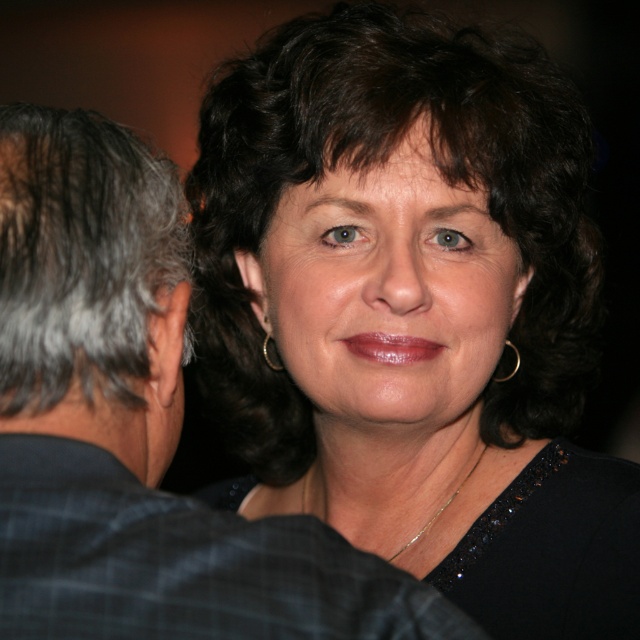
Is black fabric at center shorter than gold metallic earring at right?

No, black fabric at center is not shorter than gold metallic earring at right.

Between black fabric at center and gold metallic earring at right, which one appears on the left side from the viewer's perspective?

Positioned to the left is black fabric at center.

Where is `black fabric at center`? The width and height of the screenshot is (640, 640). black fabric at center is located at coordinates (413, 310).

Where is `black fabric at center`? black fabric at center is located at coordinates point(413,310).

From the picture: Between black fabric at center and plaid fabric shirt at left, which one is positioned lower?

plaid fabric shirt at left is lower down.

Which of these two, black fabric at center or plaid fabric shirt at left, stands shorter?

With less height is plaid fabric shirt at left.

You are a GUI agent. You are given a task and a screenshot of the screen. Output one action in this format:
    pyautogui.click(x=<x>, y=<y>)
    Task: Click on the black fabric at center
    Image resolution: width=640 pixels, height=640 pixels.
    Given the screenshot: What is the action you would take?
    pyautogui.click(x=413, y=310)

Which is more to the right, plaid fabric shirt at left or gold metallic earring at right?

gold metallic earring at right

Between point (116, 237) and point (504, 340), which one is positioned in front?

Positioned in front is point (116, 237).

I want to click on plaid fabric shirt at left, so click(x=134, y=426).